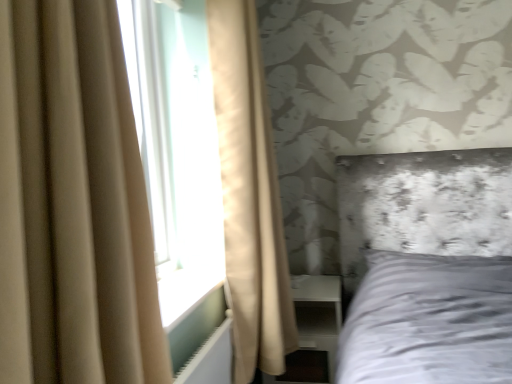
Question: Does white glossy dresser at lower right have a greater height compared to beige fabric curtain at left, positioned as the second curtain in front-to-back order?

Choices:
 (A) yes
 (B) no

Answer: (B)

Question: Is white glossy dresser at lower right closer to the viewer compared to beige fabric curtain at left, positioned as the second curtain in front-to-back order?

Choices:
 (A) yes
 (B) no

Answer: (B)

Question: Does white glossy dresser at lower right contain beige fabric curtain at left, the 1th curtain positioned from the back?

Choices:
 (A) no
 (B) yes

Answer: (A)

Question: Considering the relative sizes of white glossy dresser at lower right and beige fabric curtain at left, positioned as the second curtain in front-to-back order, in the image provided, is white glossy dresser at lower right thinner than beige fabric curtain at left, positioned as the second curtain in front-to-back order,?

Choices:
 (A) no
 (B) yes

Answer: (A)

Question: Considering the relative sizes of white glossy dresser at lower right and beige fabric curtain at left, positioned as the second curtain in front-to-back order, in the image provided, is white glossy dresser at lower right shorter than beige fabric curtain at left, positioned as the second curtain in front-to-back order,?

Choices:
 (A) yes
 (B) no

Answer: (A)

Question: Is white glossy dresser at lower right far away from beige fabric curtain at left, the 1th curtain positioned from the back?

Choices:
 (A) yes
 (B) no

Answer: (B)

Question: From the image's perspective, is white glossy dresser at lower right below white plastic radiator at lower left?

Choices:
 (A) yes
 (B) no

Answer: (A)

Question: Is the depth of white glossy dresser at lower right greater than that of white plastic radiator at lower left?

Choices:
 (A) yes
 (B) no

Answer: (A)

Question: Can you see white glossy dresser at lower right touching white plastic radiator at lower left?

Choices:
 (A) yes
 (B) no

Answer: (B)

Question: Is white glossy dresser at lower right taller than white plastic radiator at lower left?

Choices:
 (A) yes
 (B) no

Answer: (A)

Question: Can you confirm if white glossy dresser at lower right is smaller than white plastic radiator at lower left?

Choices:
 (A) no
 (B) yes

Answer: (A)

Question: Is white plastic radiator at lower left surrounded by white glossy dresser at lower right?

Choices:
 (A) yes
 (B) no

Answer: (B)

Question: Is white plastic radiator at lower left taller than beige fabric curtain at left, positioned as the second curtain in front-to-back order?

Choices:
 (A) no
 (B) yes

Answer: (A)